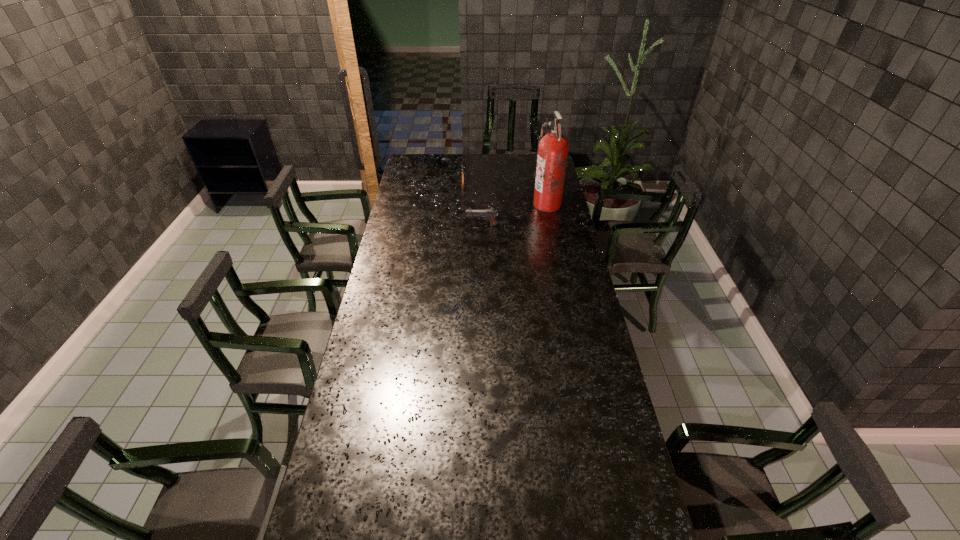
The image size is (960, 540). Identify the location of free space located along the barrel of the farthest object. (465, 157).

Identify the location of free location located along the barrel of the farthest object. The height and width of the screenshot is (540, 960). (465, 158).

Locate an element on the screen. free location located in the direction the nearer gun is aimed is located at coordinates (420, 225).

I want to click on vacant region located in the direction the nearer gun is aimed, so click(x=398, y=225).

Where is `free space located 0.080m in the direction the nearer gun is aimed`? The width and height of the screenshot is (960, 540). free space located 0.080m in the direction the nearer gun is aimed is located at coordinates (449, 225).

Locate an element on the screen. The height and width of the screenshot is (540, 960). object located in the far edge section of the desktop is located at coordinates (462, 165).

You are a GUI agent. You are given a task and a screenshot of the screen. Output one action in this format:
    pyautogui.click(x=<x>, y=<y>)
    Task: Click on the object present at the right edge
    This screenshot has width=960, height=540.
    Given the screenshot: What is the action you would take?
    pyautogui.click(x=552, y=152)

Identify the location of free point at the far edge. pos(506,173).

The image size is (960, 540). Identify the location of blank area at the left edge. (419, 239).

The height and width of the screenshot is (540, 960). I want to click on vacant space at the right edge of the desktop, so click(625, 436).